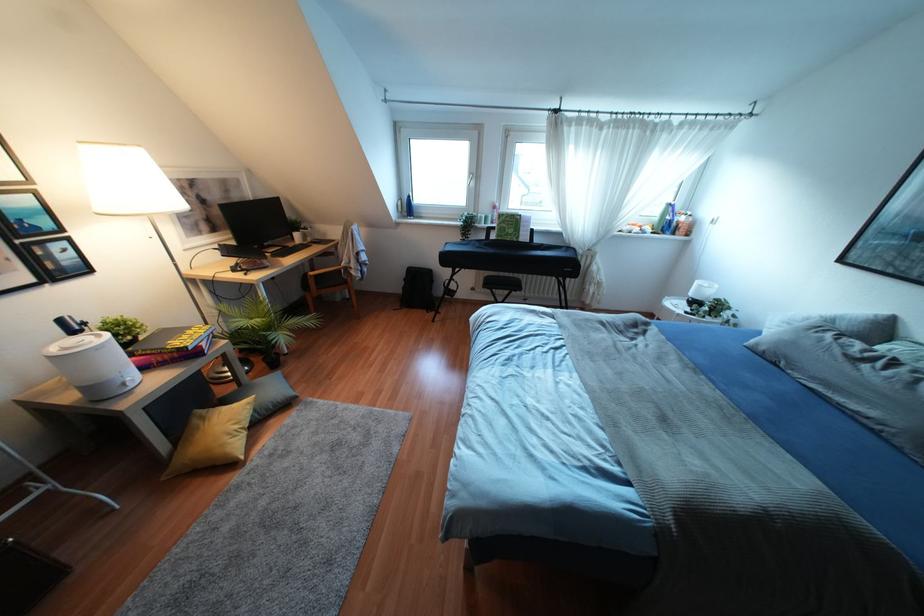
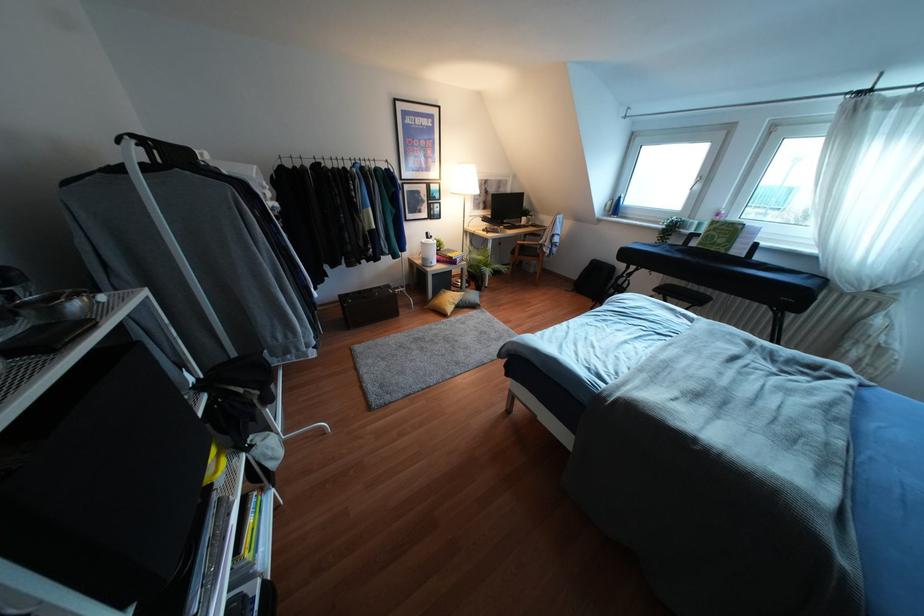
In the second image, find the point that corresponds to [195,421] in the first image.

(441, 292)